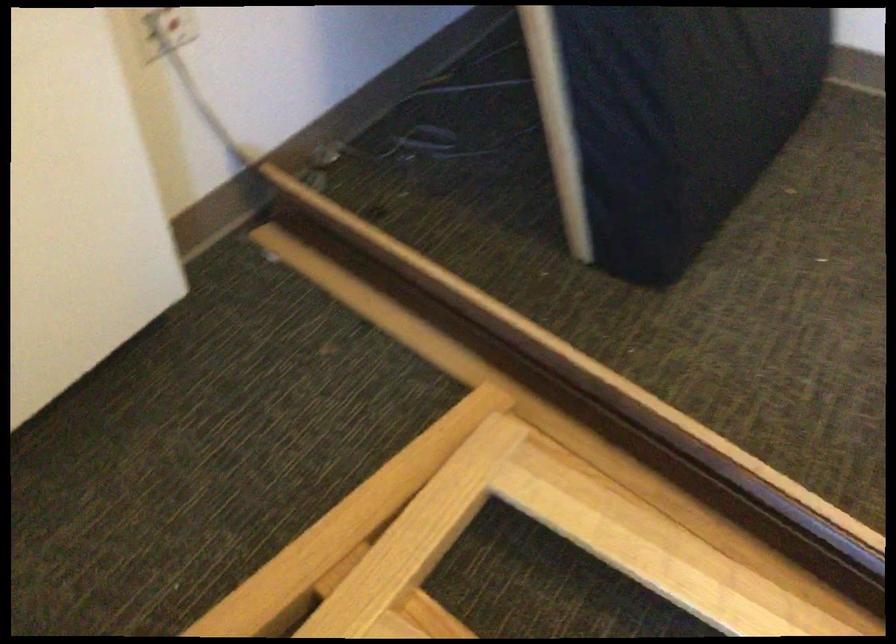
Question: The images are taken continuously from a first-person perspective. In which direction is your viewpoint rotating?

Choices:
 (A) Left
 (B) Right
 (C) Up
 (D) Down

Answer: (B)